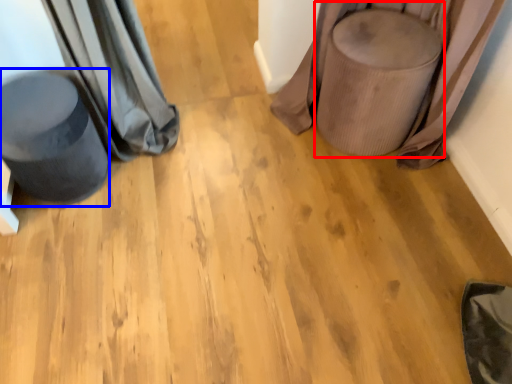
Question: Among these objects, which one is nearest to the camera, swivel chair (highlighted by a red box) or swivel chair (highlighted by a blue box)?

Choices:
 (A) swivel chair
 (B) swivel chair

Answer: (B)